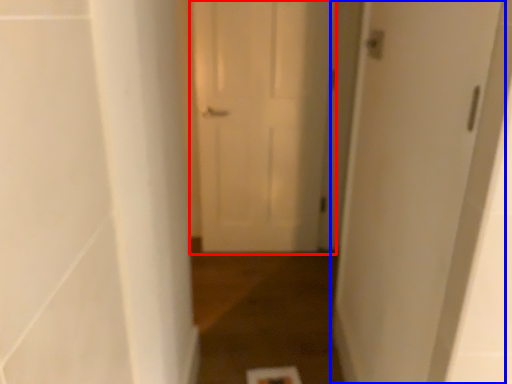
Question: Which of the following is the closest to the observer, door (highlighted by a red box) or door (highlighted by a blue box)?

Choices:
 (A) door
 (B) door

Answer: (B)